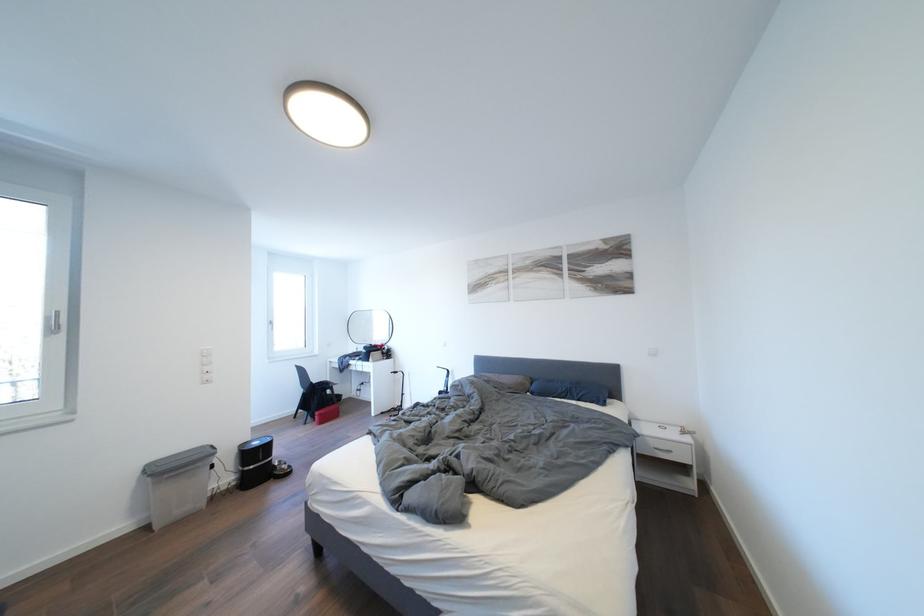
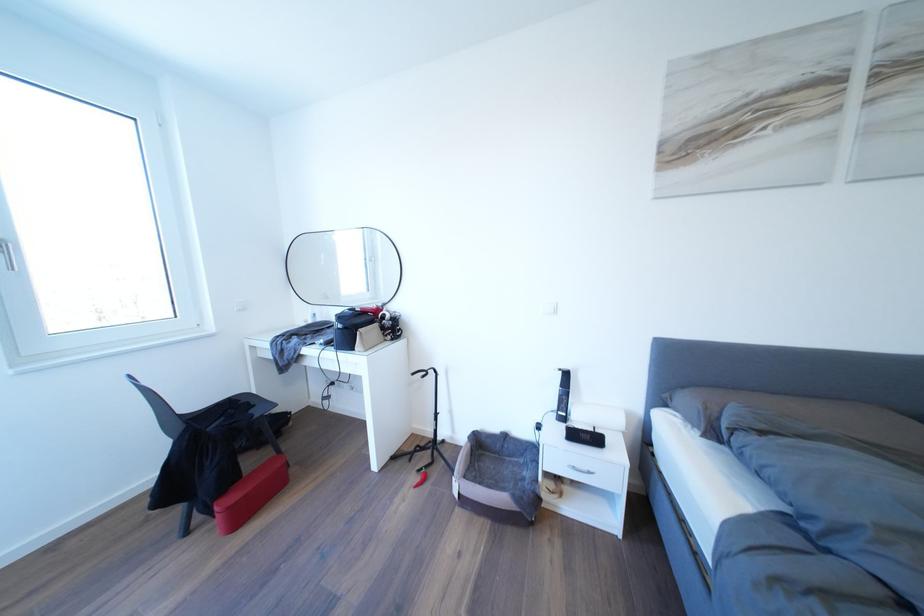
In a continuous first-person perspective shot, in which direction is the camera moving?

The cameraman moved toward left, forward.